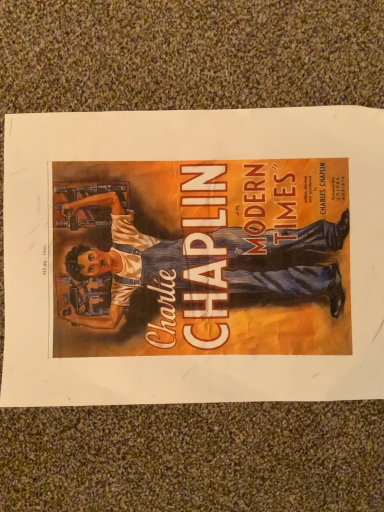
I want to click on free space above matte blue overalls at center (from a real-world perspective), so click(x=208, y=260).